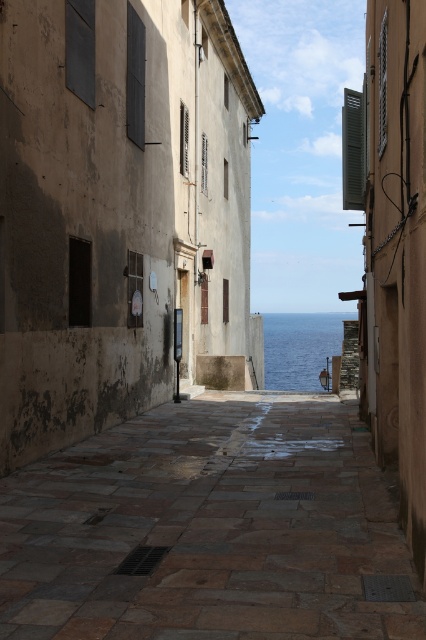
Question: Does blue water at center have a lesser width compared to matte wood shutter at lower left?

Choices:
 (A) no
 (B) yes

Answer: (A)

Question: Among these points, which one is farthest from the camera?

Choices:
 (A) (351, 138)
 (B) (184, 160)
 (C) (382, 131)

Answer: (B)

Question: Does wooden textured shutter at upper center have a larger size compared to brown wooden shutter at upper center?

Choices:
 (A) no
 (B) yes

Answer: (B)

Question: Does green painted wood shutter at upper right have a smaller size compared to wooden textured shutter at upper center?

Choices:
 (A) yes
 (B) no

Answer: (B)

Question: Which of the following is the farthest from the observer?

Choices:
 (A) (68, 44)
 (B) (135, 282)
 (C) (347, 90)

Answer: (B)

Question: Which point is farther to the camera?

Choices:
 (A) (138, 323)
 (B) (382, 145)
 (C) (75, 54)
 (D) (241, 433)

Answer: (A)